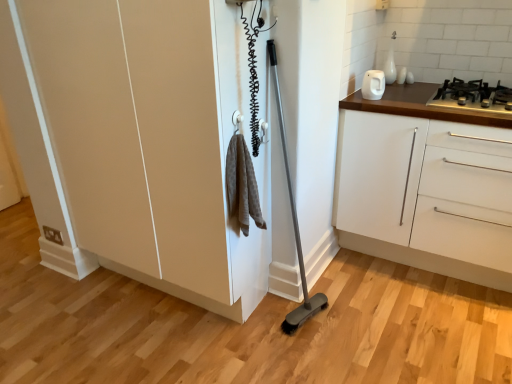
Question: Is matte beige cupboard at center in front of or behind black metal gas stove at upper right in the image?

Choices:
 (A) behind
 (B) front

Answer: (B)

Question: In the image, is matte beige cupboard at center on the left side or the right side of black metal gas stove at upper right?

Choices:
 (A) right
 (B) left

Answer: (B)

Question: Which of these objects is positioned closest to the matte beige cupboard at center?

Choices:
 (A) white glossy kettle at upper right
 (B) black metal gas stove at upper right
 (C) white glossy cabinet at right

Answer: (C)

Question: Which of these objects is positioned closest to the white glossy cabinet at right?

Choices:
 (A) matte beige cupboard at center
 (B) black metal gas stove at upper right
 (C) white glossy kettle at upper right

Answer: (B)